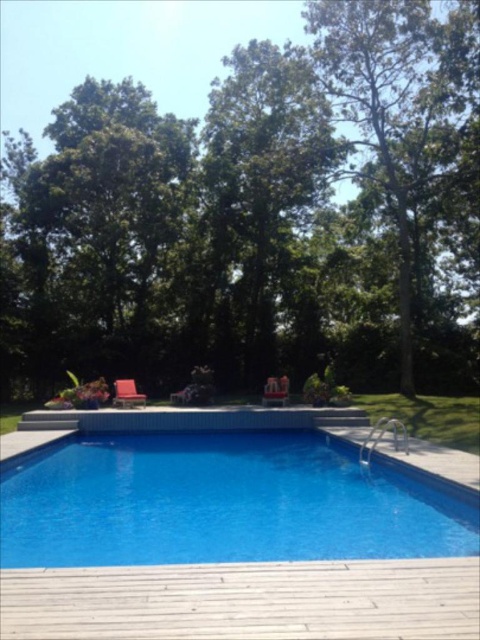
You are planning to install a new solar panel system on the roof of your house. The solar panels need to be placed where they won not be shaded by any objects. Based on the image, is the area above the blue tile swimming pool at center shaded by the green leafy tree at upper center?

The green leafy tree at upper center is above the blue tile swimming pool at center, so the area above the blue tile swimming pool at center is shaded by the green leafy tree at upper center. Therefore, placing solar panels there would be shaded and not ideal.

You are standing on the wooden deck and want to sit down. Which object, the blue tile swimming pool at center or the metallic red chair at center, is the correct place to sit?

The metallic red chair at center is the correct place to sit because the blue tile swimming pool at center is below it and likely filled with water.

You are standing on the wooden deck at lower center and want to walk towards the metallic silver chair at center. Which direction should you move to reach it?

Since the wooden deck at lower center is in front of the metallic silver chair at center, you should move backward to reach the metallic silver chair at center.